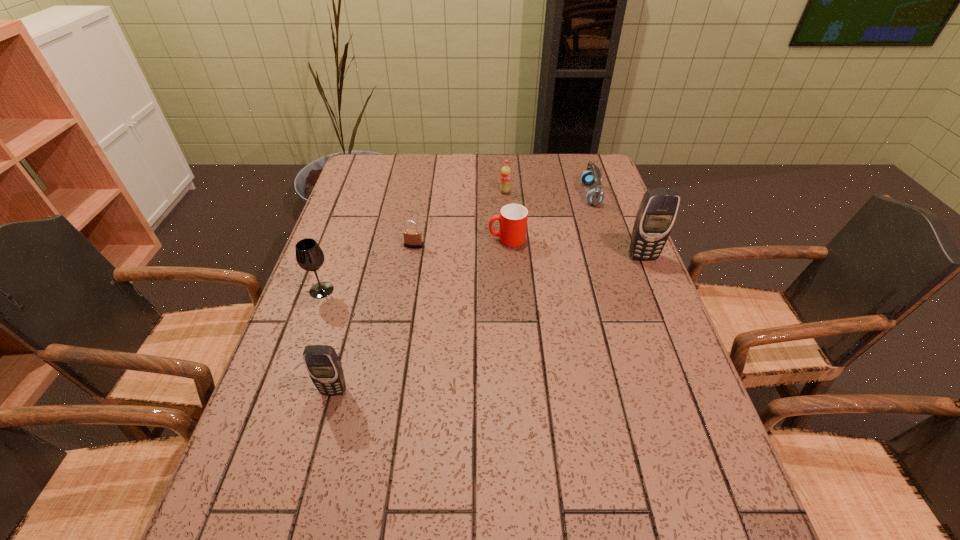
I want to click on the shorter cellular telephone, so click(x=322, y=362).

The height and width of the screenshot is (540, 960). I want to click on the nearer cellular telephone, so click(x=322, y=362).

The width and height of the screenshot is (960, 540). In order to click on the farther cellular telephone in this screenshot , I will do `click(657, 212)`.

Locate an element on the screen. Image resolution: width=960 pixels, height=540 pixels. the third nearest object is located at coordinates (657, 212).

The width and height of the screenshot is (960, 540). What are the coordinates of `soda` in the screenshot? It's located at (505, 177).

Locate an element on the screen. headset is located at coordinates (592, 175).

I want to click on cup, so click(513, 218).

Locate an element on the screen. The height and width of the screenshot is (540, 960). the sixth farthest object is located at coordinates (309, 255).

Locate an element on the screen. The height and width of the screenshot is (540, 960). wineglass is located at coordinates [x=309, y=255].

The height and width of the screenshot is (540, 960). In order to click on the fifth object from right to left in this screenshot , I will do coord(412,238).